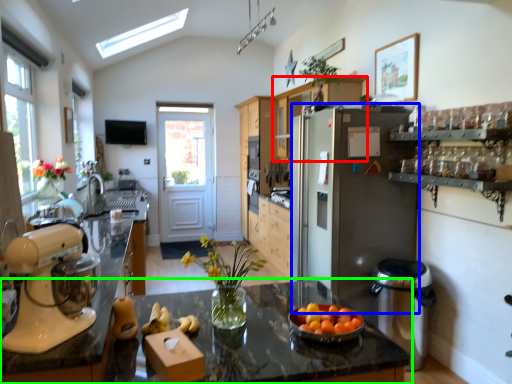
Question: Which object is positioned closest to cabinetry (highlighted by a red box)? Select from refrigerator (highlighted by a blue box) and countertop (highlighted by a green box).

Choices:
 (A) refrigerator
 (B) countertop

Answer: (A)